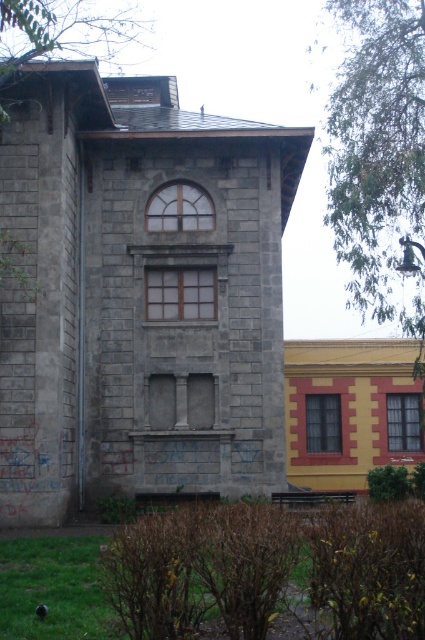
Consider the image. You are a painter standing 10 meters away from the clear glass window at center. You want to paint the brown wooden window at center but your ladder can only reach 12 meters. Can you reach it without moving closer?

The distance between the brown wooden window at center and the clear glass window at center is 12.16 meters. Since you are 10 meters away from the clear glass window at center, the brown wooden window at center is 12.16 meters away from you. Your ladder can only reach 12 meters, so you cannot reach it without moving closer.

You are standing in front of the two story building. You need to locate the brown wooden window at center. Where is it positioned in terms of coordinates?

The brown wooden window at center is positioned at coordinates (180,292).